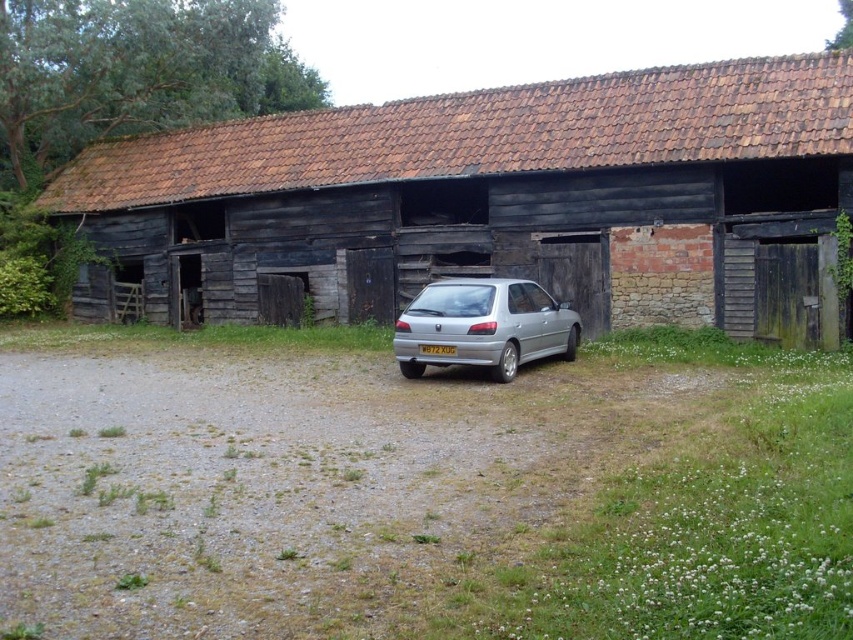
At what (x,y) coordinates should I click in order to perform the action: click on rustic wooden barn at center. Please return your answer as a coordinate pair (x, y). The image size is (853, 640). Looking at the image, I should click on (495, 200).

Can you confirm if rustic wooden barn at center is wider than white plastic license plate at center?

Yes, rustic wooden barn at center is wider than white plastic license plate at center.

The width and height of the screenshot is (853, 640). I want to click on rustic wooden barn at center, so click(495, 200).

Which is above, silver metallic hatchback at center or white plastic license plate at center?

silver metallic hatchback at center is above.

Locate an element on the screen. silver metallic hatchback at center is located at coordinates (485, 324).

Who is positioned more to the right, rustic wooden barn at center or silver metallic hatchback at center?

silver metallic hatchback at center is more to the right.

Does rustic wooden barn at center have a greater height compared to silver metallic hatchback at center?

Yes.

Find the location of `rustic wooden barn at center`. rustic wooden barn at center is located at coordinates (495, 200).